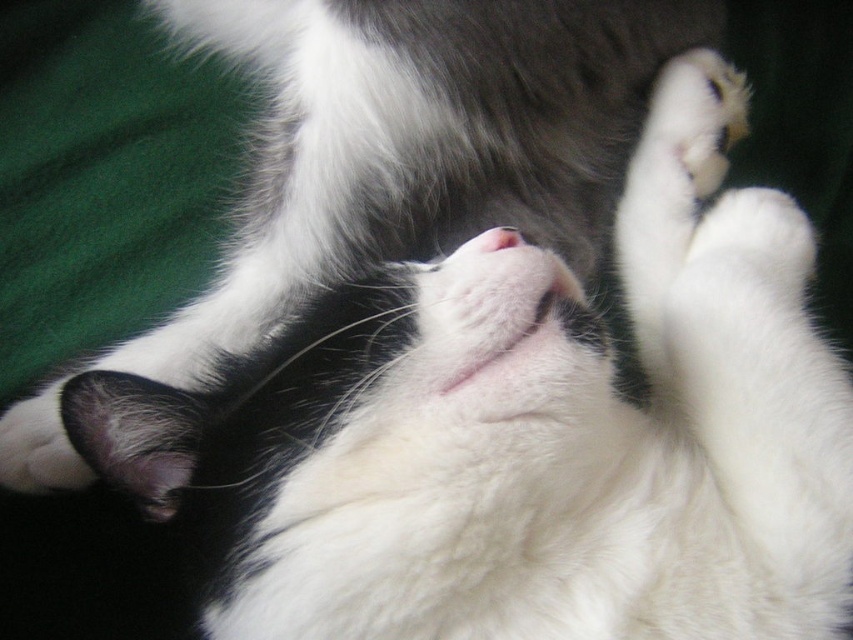
Question: Which point is closer to the camera taking this photo?

Choices:
 (A) (544, 216)
 (B) (500, 228)

Answer: (B)

Question: Which object is closer to the camera taking this photo?

Choices:
 (A) pink fur at center
 (B) white fluffy cat at center

Answer: (A)

Question: Is white fluffy cat at center to the left of pink fur at center from the viewer's perspective?

Choices:
 (A) yes
 (B) no

Answer: (A)

Question: In this image, where is white fluffy cat at center located relative to pink fur at center?

Choices:
 (A) right
 (B) left

Answer: (B)

Question: Can you confirm if white fluffy cat at center is smaller than pink fur at center?

Choices:
 (A) yes
 (B) no

Answer: (B)